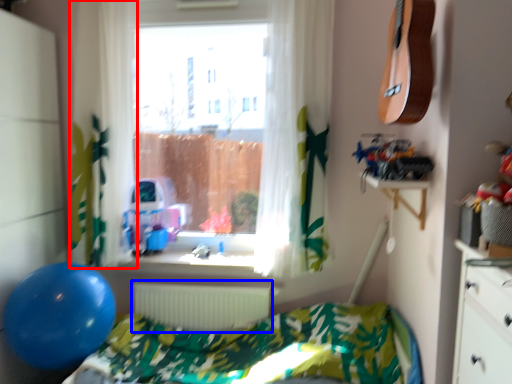
Question: Which object appears closest to the camera in this image, curtain (highlighted by a red box) or radiator (highlighted by a blue box)?

Choices:
 (A) curtain
 (B) radiator

Answer: (A)